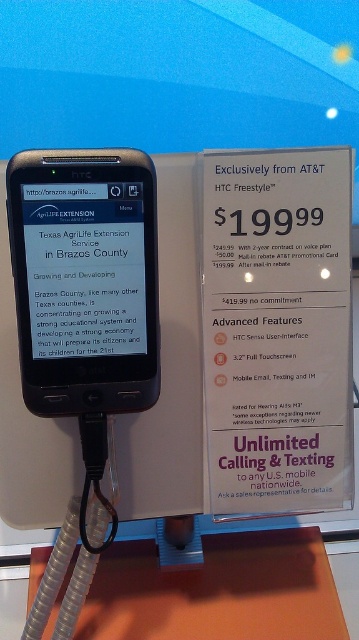
You are organizing a tech exhibition and need to ensure that the matte black phone at center is visible from above the orange matte table at lower center. Given their sizes, will the phone obscure the table when viewed from above?

The matte black phone at center is much taller than the orange matte table at lower center, so when viewed from above, the phone will likely obscure the table due to its greater height.